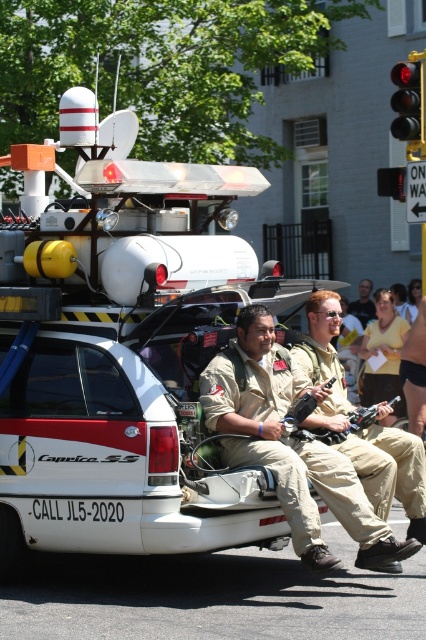
Is tan uniform at center above matte khaki uniform at center?

No, tan uniform at center is not above matte khaki uniform at center.

Does point (382, 413) lie in front of point (368, 282)?

Yes.

Where is `tan uniform at center`? tan uniform at center is located at coordinates (391, 472).

Between tan uniform at center and red glass traffic light at upper right, which one appears on the right side from the viewer's perspective?

From the viewer's perspective, red glass traffic light at upper right appears more on the right side.

Between point (337, 305) and point (417, 125), which one is positioned behind?

The point (417, 125) is behind.

You are a GUI agent. You are given a task and a screenshot of the screen. Output one action in this format:
    pyautogui.click(x=<x>, y=<y>)
    Task: Click on the tan uniform at center
    The image size is (426, 640).
    Given the screenshot: What is the action you would take?
    pyautogui.click(x=391, y=472)

Who is positioned more to the right, red glass traffic light at upper right or matte khaki uniform at center?

matte khaki uniform at center

Does red glass traffic light at upper right come behind matte khaki uniform at center?

That is False.

Which is in front, point (414, 116) or point (367, 308)?

Point (414, 116) is more forward.

Locate an element on the screen. Image resolution: width=426 pixels, height=640 pixels. red glass traffic light at upper right is located at coordinates (408, 100).